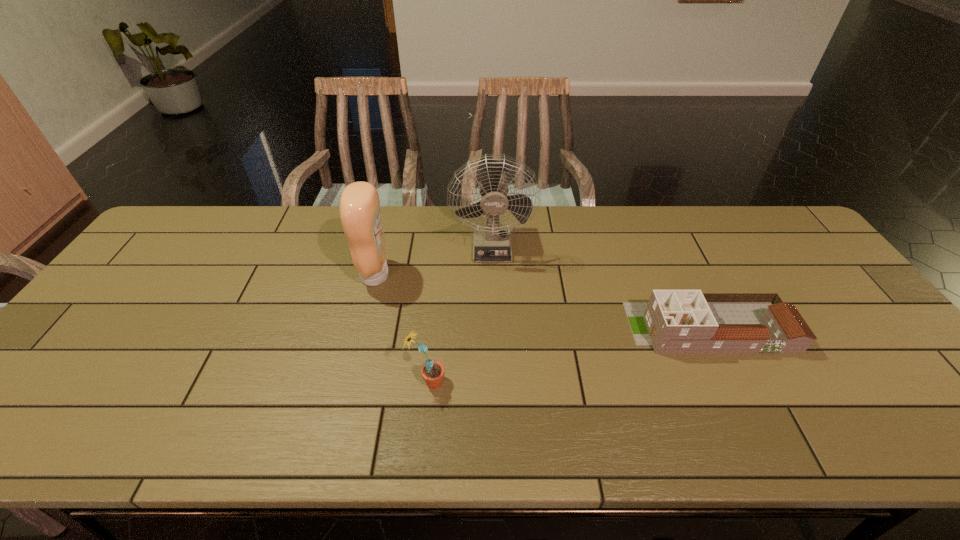
Where is `fan`? This screenshot has height=540, width=960. fan is located at coordinates (491, 244).

Locate an element on the screen. The image size is (960, 540). the third shortest object is located at coordinates (359, 207).

This screenshot has width=960, height=540. What are the coordinates of `condiment` in the screenshot? It's located at (359, 207).

Locate an element on the screen. The width and height of the screenshot is (960, 540). sunflower is located at coordinates (433, 371).

Locate an element on the screen. This screenshot has height=540, width=960. the third tallest object is located at coordinates (433, 371).

Where is `the shortest object`? the shortest object is located at coordinates (x=673, y=321).

At what (x,y) coordinates should I click in order to perform the action: click on the rightmost object. Please return your answer as a coordinate pair (x, y). Looking at the image, I should click on (673, 321).

Where is `free space located 0.120m on the air flow direction of the fan`? free space located 0.120m on the air flow direction of the fan is located at coordinates (493, 293).

I want to click on free region located 0.150m on the label of the condiment, so click(443, 275).

In order to click on vacant area located on the flower of the sunflower in this screenshot , I will do [510, 382].